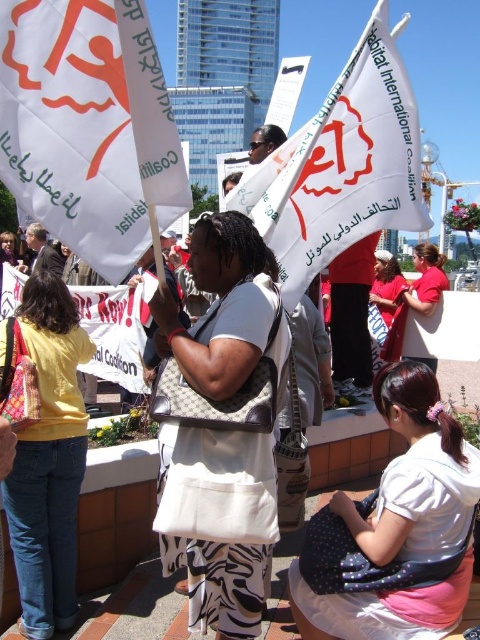
You are a photographer at the protest scene. You want to capture a photo that includes both the white paper flag at upper center and the denim jeans at lower left. Considering their sizes, which object should you zoom in on to ensure both fit in the frame?

The white paper flag at upper center is wider than the denim jeans at lower left. To capture both in the frame, you should zoom out slightly to accommodate the wider flag.